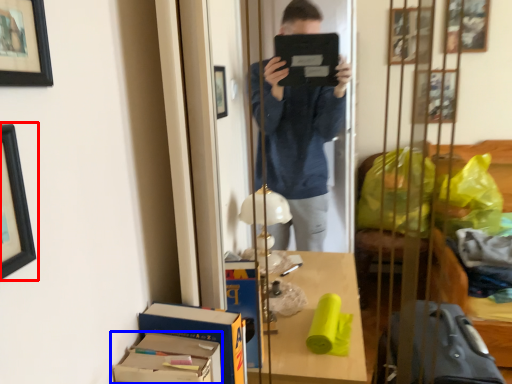
Question: Which object appears closest to the camera in this image, picture frame (highlighted by a red box) or cardboard box (highlighted by a blue box)?

Choices:
 (A) picture frame
 (B) cardboard box

Answer: (A)